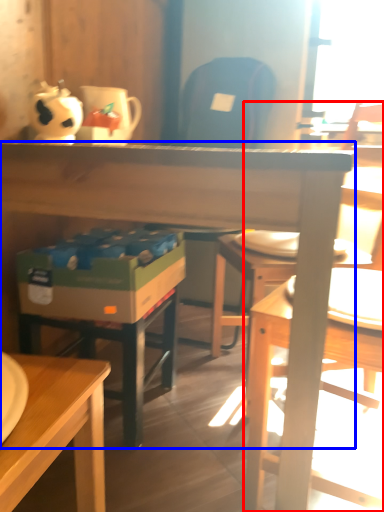
Question: Which point is closer to the camera, chair (highlighted by a red box) or desk (highlighted by a blue box)?

Choices:
 (A) chair
 (B) desk

Answer: (B)